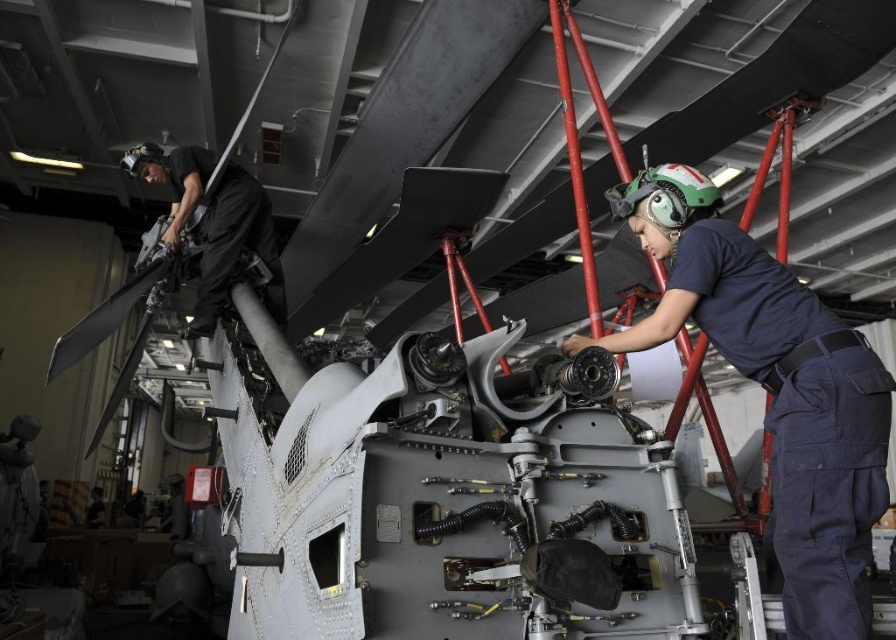
Question: Which object appears farthest from the camera in this image?

Choices:
 (A) black fabric helmet at upper left
 (B) navy blue uniform at center

Answer: (A)

Question: Can you confirm if navy blue uniform at center is wider than black fabric helmet at upper left?

Choices:
 (A) yes
 (B) no

Answer: (B)

Question: In this image, where is navy blue uniform at center located relative to black fabric helmet at upper left?

Choices:
 (A) above
 (B) below

Answer: (B)

Question: Is navy blue uniform at center closer to camera compared to black fabric helmet at upper left?

Choices:
 (A) no
 (B) yes

Answer: (B)